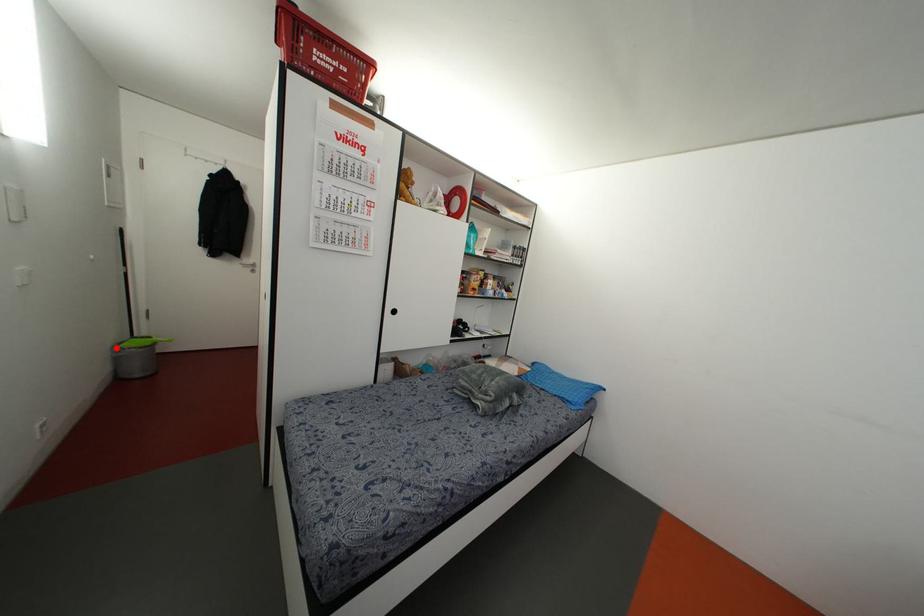
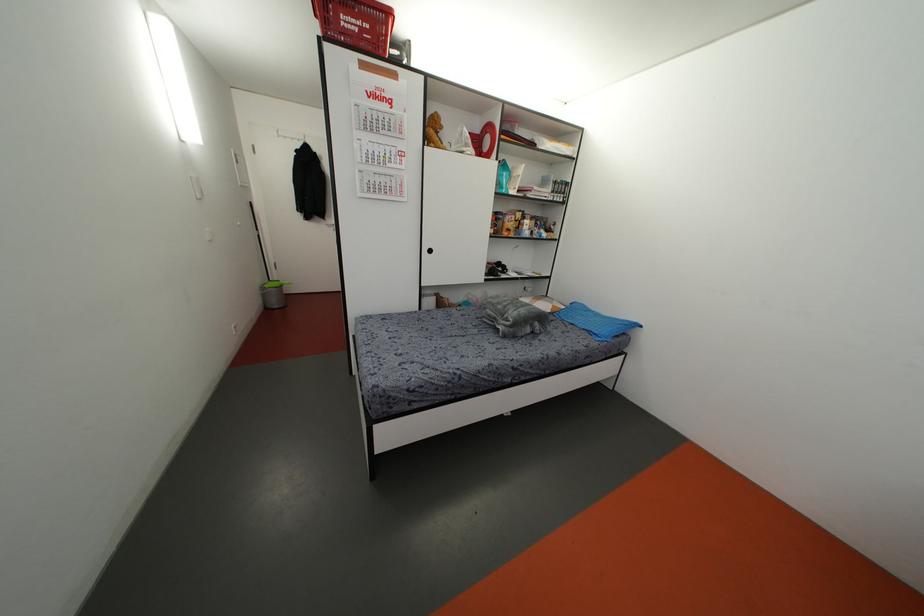
Locate, in the second image, the point that corresponds to the highlighted location in the first image.

(261, 288)